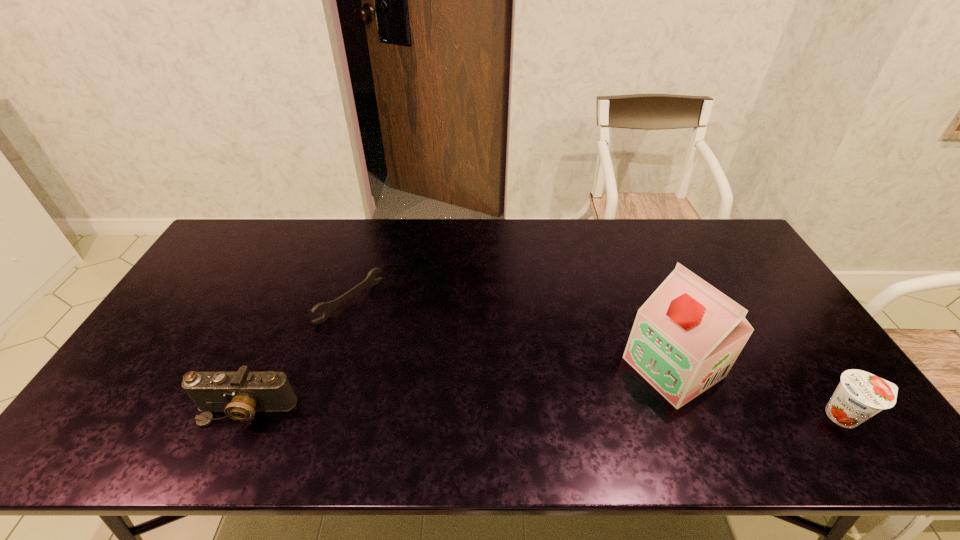
Identify which object is the third nearest to the shortest object. Please provide its 2D coordinates. Your answer should be formatted as a tuple, i.e. [(x, y)], where the tuple contains the x and y coordinates of a point satisfying the conditions above.

[(860, 395)]

This screenshot has height=540, width=960. What are the coordinates of `free space that satisfies the following two spatial constraints: 1. on the front-facing side of the camera; 2. on the left side of the rightmost object` in the screenshot? It's located at (244, 415).

Locate an element on the screen. The image size is (960, 540). vacant space that satisfies the following two spatial constraints: 1. on the front side of the yogurt; 2. on the left side of the shortest object is located at coordinates (316, 415).

Find the location of a particular element. Image resolution: width=960 pixels, height=540 pixels. vacant region that satisfies the following two spatial constraints: 1. on the front side of the rightmost object; 2. on the right side of the shortest object is located at coordinates tap(316, 415).

The width and height of the screenshot is (960, 540). Identify the location of blank space that satisfies the following two spatial constraints: 1. on the front side of the shortest object; 2. on the right side of the rightmost object. (316, 415).